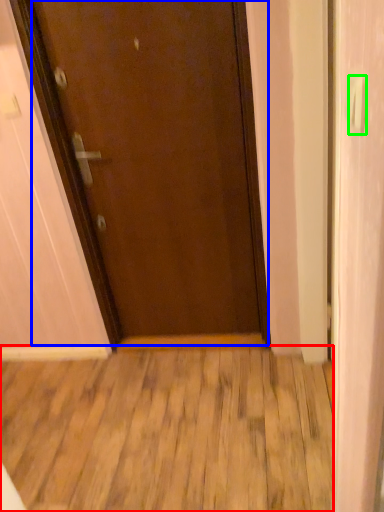
Question: Which object is positioned closest to wood (highlighted by a red box)? Select from door (highlighted by a blue box) and door handle (highlighted by a green box).

Choices:
 (A) door
 (B) door handle

Answer: (A)